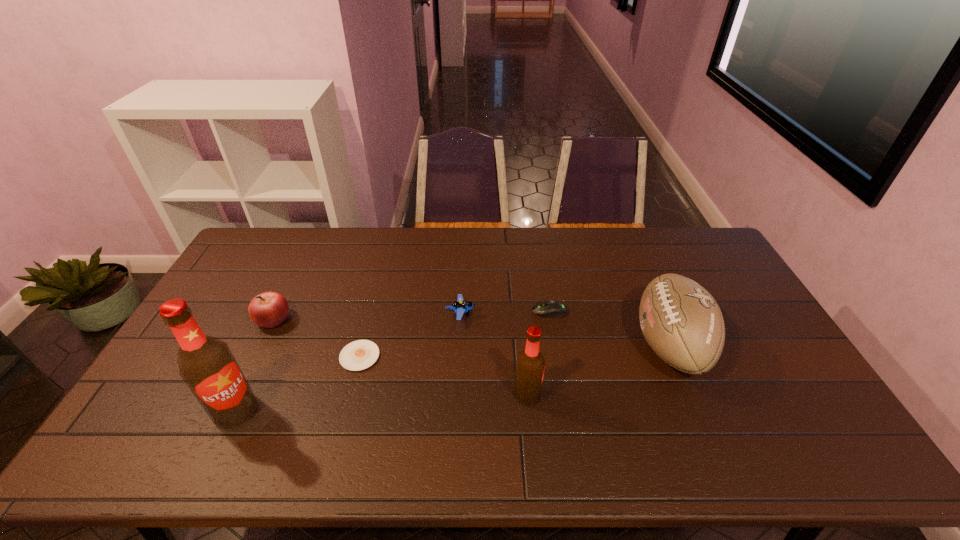
The beer bottles are evenly distributed in the image. To maintain this, where would you place another beer bottle on the right? Please point to a free space. Please provide its 2D coordinates. Your answer should be formatted as a tuple, i.e. [(x, y)], where the tuple contains the x and y coordinates of a point satisfying the conditions above.

[(801, 380)]